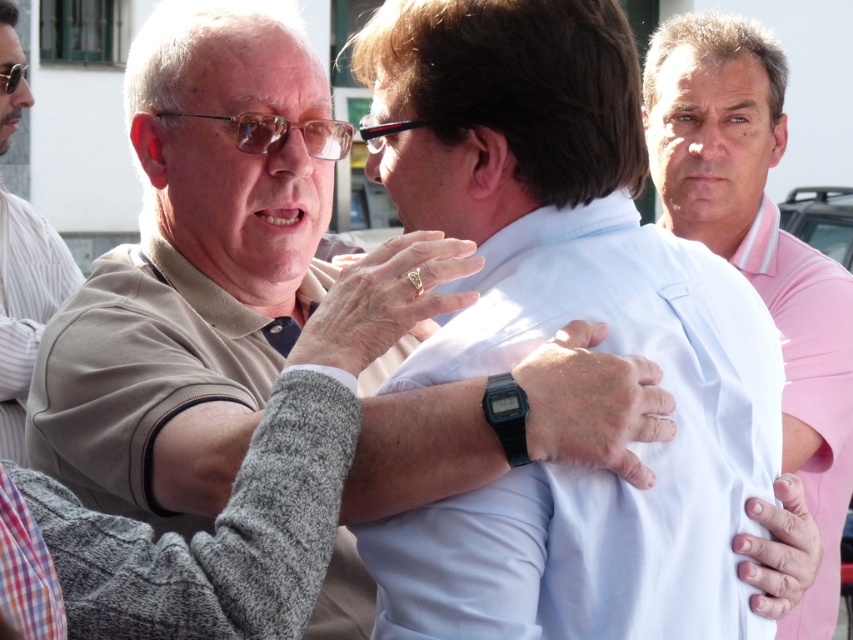
Who is taller, pink cotton polo shirt at center or beige fabric shirt at left?

Standing taller between the two is pink cotton polo shirt at center.

Which of these two, pink cotton polo shirt at center or beige fabric shirt at left, stands shorter?

beige fabric shirt at left is shorter.

Does point (792, 454) lie in front of point (27, 332)?

Yes.

Locate an element on the screen. The height and width of the screenshot is (640, 853). pink cotton polo shirt at center is located at coordinates (758, 250).

Can you confirm if white smooth shirt at center is smaller than beige fabric shirt at left?

Yes.

Which is behind, point (625, 74) or point (1, 428)?

The point (1, 428) is behind.

Locate an element on the screen. white smooth shirt at center is located at coordinates (558, 326).

Is white smooth shirt at center below pink cotton polo shirt at center?

Indeed, white smooth shirt at center is positioned under pink cotton polo shirt at center.

Who is more forward, [569,628] or [752,131]?

Point [569,628] is in front.

Which is behind, point (456, 230) or point (697, 61)?

Point (697, 61)

Locate an element on the screen. This screenshot has height=640, width=853. white smooth shirt at center is located at coordinates (558, 326).